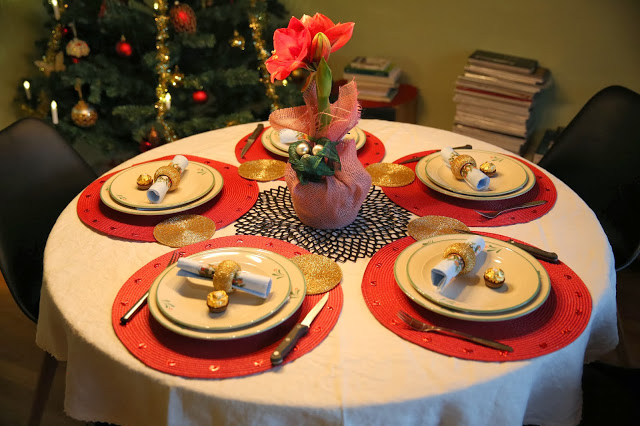
You are a GUI agent. You are given a task and a screenshot of the screen. Output one action in this format:
    pyautogui.click(x=<x>, y=<y>)
    Task: Click on the table elegantly set
    
    Given the screenshot: What is the action you would take?
    pyautogui.click(x=264, y=304), pyautogui.click(x=489, y=301), pyautogui.click(x=500, y=185), pyautogui.click(x=202, y=182)